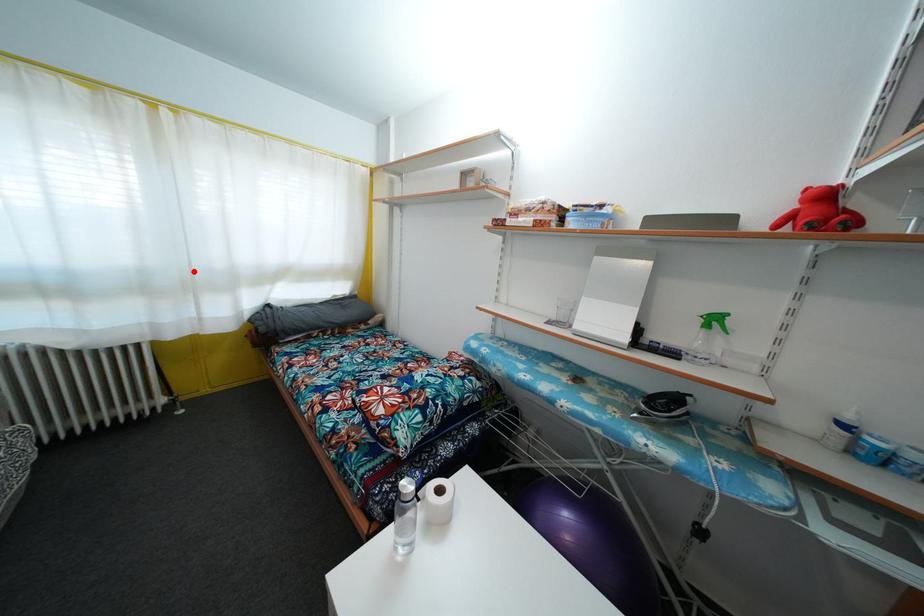
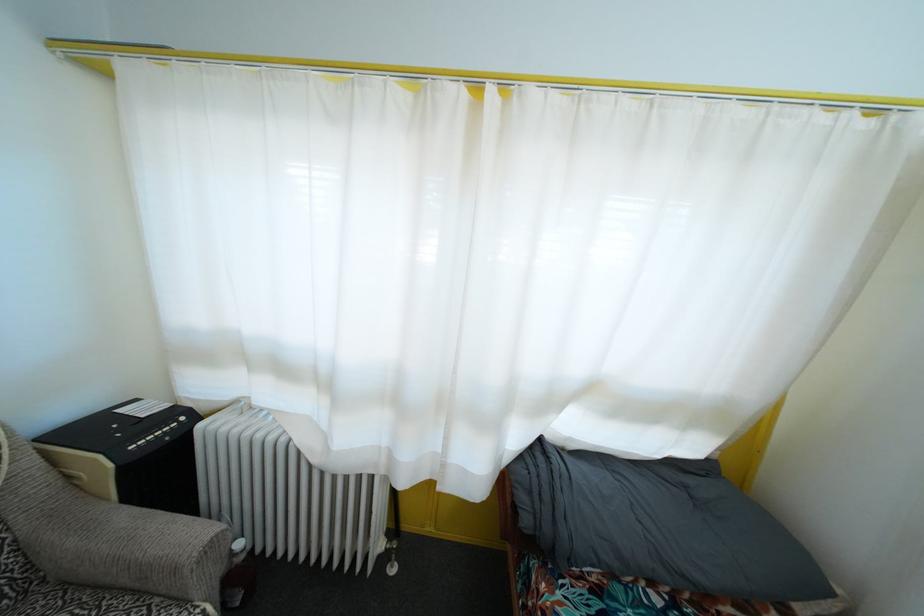
Where in the second image is the point corresponding to the highlighted location from the first image?

(457, 379)